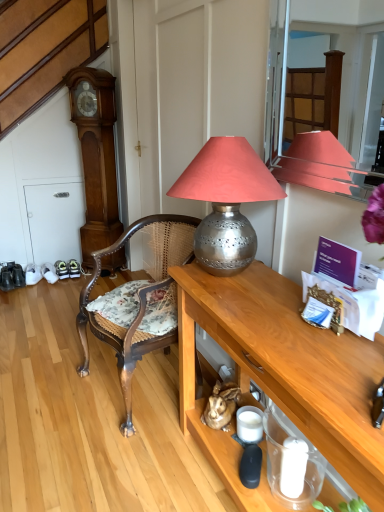
Describe the element at coordinates (139, 302) in the screenshot. I see `woven cane chair at center` at that location.

What do you see at coordinates (291, 463) in the screenshot? I see `translucent glass jar at lower right` at bounding box center [291, 463].

Describe the element at coordinates (282, 375) in the screenshot. The height and width of the screenshot is (512, 384). I see `wooden table at center` at that location.

Where is `woven cane chair at center`? woven cane chair at center is located at coordinates (139, 302).

Between woven cane chair at center and translucent glass jar at lower right, which one has smaller size?

With smaller size is translucent glass jar at lower right.

How different are the orientations of woven cane chair at center and translucent glass jar at lower right in degrees?

10.4 degrees.

Is woven cane chair at center outside of translucent glass jar at lower right?

That's correct, woven cane chair at center is outside of translucent glass jar at lower right.

Does woven cane chair at center have a lesser width compared to translucent glass jar at lower right?

No, woven cane chair at center is not thinner than translucent glass jar at lower right.

Considering the points (195, 232) and (103, 140), which point is behind, point (195, 232) or point (103, 140)?

The point (103, 140) is behind.

Can you confirm if silver metallic lampshade at center is smaller than wooden grandfather clock at left?

Correct, silver metallic lampshade at center occupies less space than wooden grandfather clock at left.

From their relative heights in the image, would you say silver metallic lampshade at center is taller or shorter than wooden grandfather clock at left?

Clearly, silver metallic lampshade at center is shorter compared to wooden grandfather clock at left.

What's the angular difference between silver metallic lampshade at center and wooden grandfather clock at left's facing directions?

The angle between the facing direction of silver metallic lampshade at center and the facing direction of wooden grandfather clock at left is 44.8 degrees.

Can you tell me how much silver metallic lampshade at center and translucent glass jar at lower right differ in facing direction?

0.458 degrees.

In the scene shown: Does silver metallic lampshade at center have a larger size compared to translucent glass jar at lower right?

Correct, silver metallic lampshade at center is larger in size than translucent glass jar at lower right.

Considering the relative positions of silver metallic lampshade at center and translucent glass jar at lower right in the image provided, is silver metallic lampshade at center to the right of translucent glass jar at lower right from the viewer's perspective?

No, silver metallic lampshade at center is not to the right of translucent glass jar at lower right.

Considering the relative positions of silver metallic lampshade at center and translucent glass jar at lower right in the image provided, is silver metallic lampshade at center behind translucent glass jar at lower right?

No, it is not.

Locate an element on the screen. desk lying in front of the woven cane chair at center is located at coordinates (282, 375).

Consider the image. Is wooden table at center outside of woven cane chair at center?

Absolutely, wooden table at center is external to woven cane chair at center.

From the image's perspective, which is above, wooden table at center or woven cane chair at center?

woven cane chair at center, from the image's perspective.

Is wooden table at center thinner than woven cane chair at center?

Yes.

Does point (94, 170) come behind point (223, 196)?

Yes.

Does wooden grandfather clock at left have a lesser width compared to silver metallic lampshade at center?

Correct, the width of wooden grandfather clock at left is less than that of silver metallic lampshade at center.

Is wooden grandfather clock at left further to the viewer compared to silver metallic lampshade at center?

A: Yes, the depth of wooden grandfather clock at left is greater than that of silver metallic lampshade at center.

From the image's perspective, between translucent glass jar at lower right and wooden table at center, which one is located above?

From the image's view, wooden table at center is above.

Considering the sizes of objects translucent glass jar at lower right and wooden table at center in the image provided, who is smaller, translucent glass jar at lower right or wooden table at center?

Smaller between the two is translucent glass jar at lower right.

Who is taller, translucent glass jar at lower right or wooden table at center?

wooden table at center.

Considering the positions of objects wooden table at center and wooden grandfather clock at left in the image provided, who is in front, wooden table at center or wooden grandfather clock at left?

wooden table at center is closer to the camera.

Would you say wooden table at center is a long distance from wooden grandfather clock at left?

Yes, wooden table at center is far from wooden grandfather clock at left.

The height and width of the screenshot is (512, 384). In order to click on chair above the translucent glass jar at lower right (from a real-world perspective) in this screenshot , I will do `click(139, 302)`.

Where is `clock lying above the silver metallic lampshade at center (from the image's perspective)`? This screenshot has width=384, height=512. clock lying above the silver metallic lampshade at center (from the image's perspective) is located at coordinates (96, 156).

Estimate the real-world distances between objects in this image. Which object is further from wooden grandfather clock at left, wooden table at center or woven cane chair at center?

wooden table at center is further to wooden grandfather clock at left.

Looking at this image, which object lies nearer to the anchor point wooden grandfather clock at left, woven cane chair at center or translucent glass jar at lower right?

woven cane chair at center is positioned closer to the anchor wooden grandfather clock at left.

From the image, which object appears to be farther from woven cane chair at center, wooden table at center or wooden grandfather clock at left?

wooden grandfather clock at left lies further to woven cane chair at center than the other object.

Which object lies nearer to the anchor point wooden table at center, wooden grandfather clock at left or woven cane chair at center?

woven cane chair at center.

Based on their spatial positions, is wooden grandfather clock at left or woven cane chair at center closer to silver metallic lampshade at center?

woven cane chair at center is positioned closer to the anchor silver metallic lampshade at center.

Estimate the real-world distances between objects in this image. Which object is closer to woven cane chair at center, wooden grandfather clock at left or silver metallic lampshade at center?

The object closer to woven cane chair at center is silver metallic lampshade at center.

When comparing their distances from translucent glass jar at lower right, does wooden table at center or wooden grandfather clock at left seem further?

The object further to translucent glass jar at lower right is wooden grandfather clock at left.

From the image, which object appears to be farther from wooden grandfather clock at left, wooden table at center or translucent glass jar at lower right?

Among the two, translucent glass jar at lower right is located further to wooden grandfather clock at left.

You are a GUI agent. You are given a task and a screenshot of the screen. Output one action in this format:
    pyautogui.click(x=<x>, y=<y>)
    Task: Click on the tableware between wooden table at center and woven cane chair at center from front to back
    
    Given the screenshot: What is the action you would take?
    pyautogui.click(x=291, y=463)

The width and height of the screenshot is (384, 512). I want to click on tableware between wooden table at center and wooden grandfather clock at left along the z-axis, so [291, 463].

Where is `chair between translucent glass jar at lower right and wooden grandfather clock at left along the z-axis`? chair between translucent glass jar at lower right and wooden grandfather clock at left along the z-axis is located at coordinates (139, 302).

Locate an element on the screen. The height and width of the screenshot is (512, 384). chair positioned between wooden table at center and wooden grandfather clock at left from near to far is located at coordinates (139, 302).